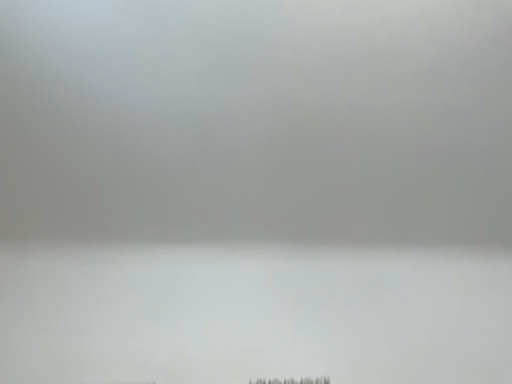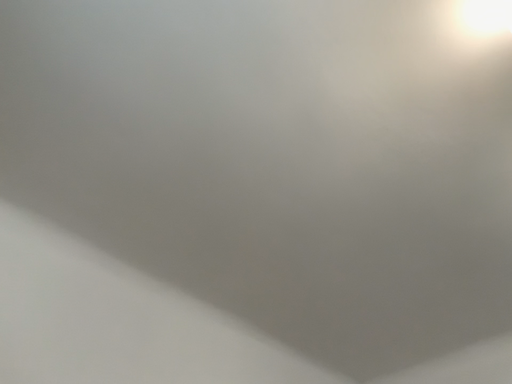
Question: Which way did the camera rotate in the video?

Choices:
 (A) rotated upward
 (B) rotated downward

Answer: (B)